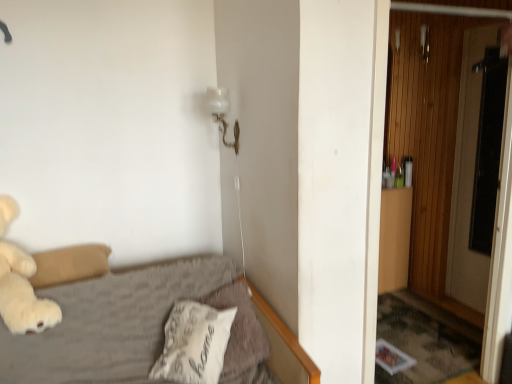
This screenshot has width=512, height=384. Identify the location of vacant region to the left of transparent glass screen door at right. (450, 305).